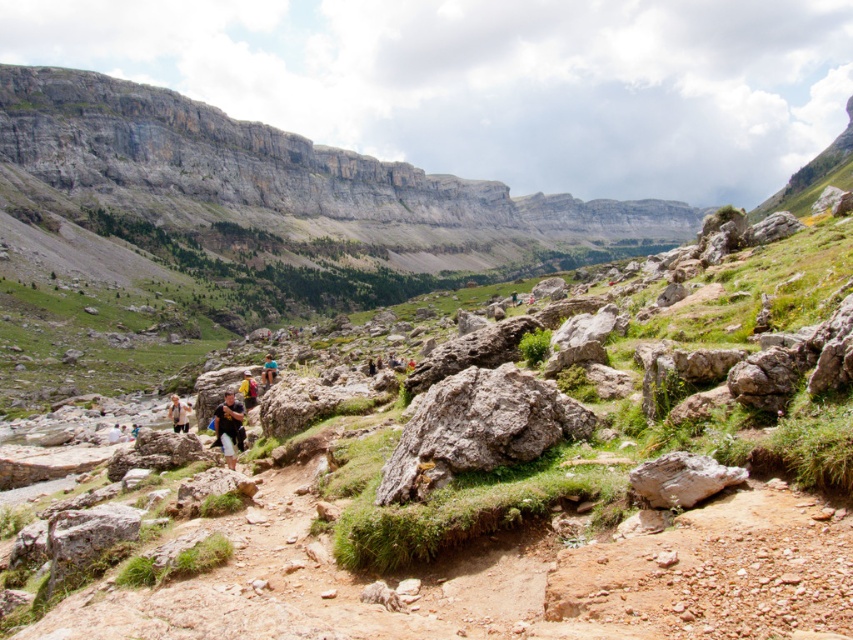
You are a photographer planning to capture a photo of the matte black shorts at lower left and the yellow fabric backpack at center. Which object should you focus on first if you want to highlight the larger one in your composition?

The matte black shorts at lower left should be focused on first since it has a larger size compared to the yellow fabric backpack at center, making it the more prominent subject in the scene.

You are standing at the point with coordinates point (254, 392) and want to move towards the point with coordinates point (181, 424). Since you are on a hiking trail, will you be moving uphill or downhill?

Point (181, 424) is closer to the camera than point (254, 392), so moving from point (254, 392) to point (181, 424) means you are moving towards a closer point. Since the foreground has rugged terrain with scattered rocks and patches of green grass, and the midground has a valley with more vegetation, moving towards the foreground would likely involve going downhill towards the rugged terrain.

You are a hiker standing at the starting point of the trail. You notice a gray rough rock at lower right and a matte black shorts at lower left. Which object is closer to your eye level?

The matte black shorts at lower left is taller than the gray rough rock at lower right, so the matte black shorts at lower left is closer to your eye level.